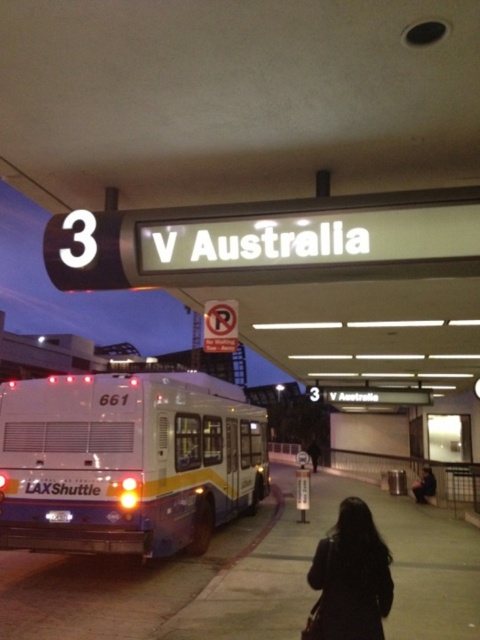
You are a traveler at the bus station and you have two coats to choose from. Which one is bigger between the dark matte coat at center and the black leather jacket at lower center?

The dark matte coat at center is larger in size than the black leather jacket at lower center.

You are a passenger waiting at the bus station and see the white glossy bus at center and the dark matte coat at center. Which object is positioned lower in the image?

The white glossy bus at center is positioned lower than the dark matte coat at center in the image.